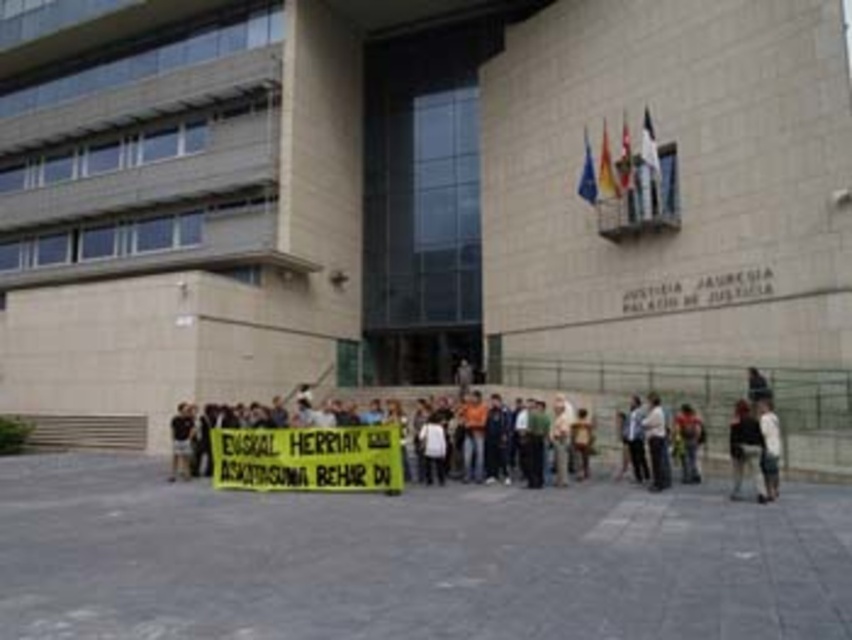
Question: Which is farther from the yellow fabric banner at center?

Choices:
 (A) dark gray fabric jacket at lower right
 (B) white cotton shirt at lower right
 (C) dark gray pants at center

Answer: (B)

Question: Considering the relative positions of dark gray pants at center and white cotton shirt at lower right in the image provided, where is dark gray pants at center located with respect to white cotton shirt at lower right?

Choices:
 (A) right
 (B) left

Answer: (B)

Question: Which of the following is the farthest from the observer?

Choices:
 (A) yellow fabric banner at center
 (B) white cotton shirt at lower right
 (C) dark gray pants at center

Answer: (A)

Question: Does dark gray fabric jacket at lower right appear under dark gray pants at center?

Choices:
 (A) yes
 (B) no

Answer: (A)

Question: Can you confirm if dark gray fabric jacket at lower right is positioned above white cotton shirt at lower right?

Choices:
 (A) yes
 (B) no

Answer: (B)

Question: Which point is farther from the camera taking this photo?

Choices:
 (A) (730, 424)
 (B) (243, 435)

Answer: (A)